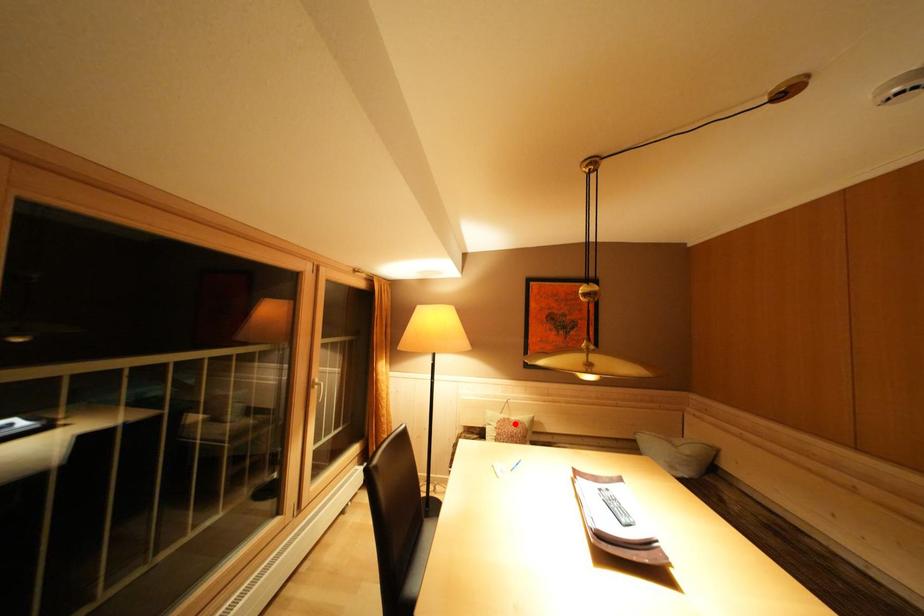
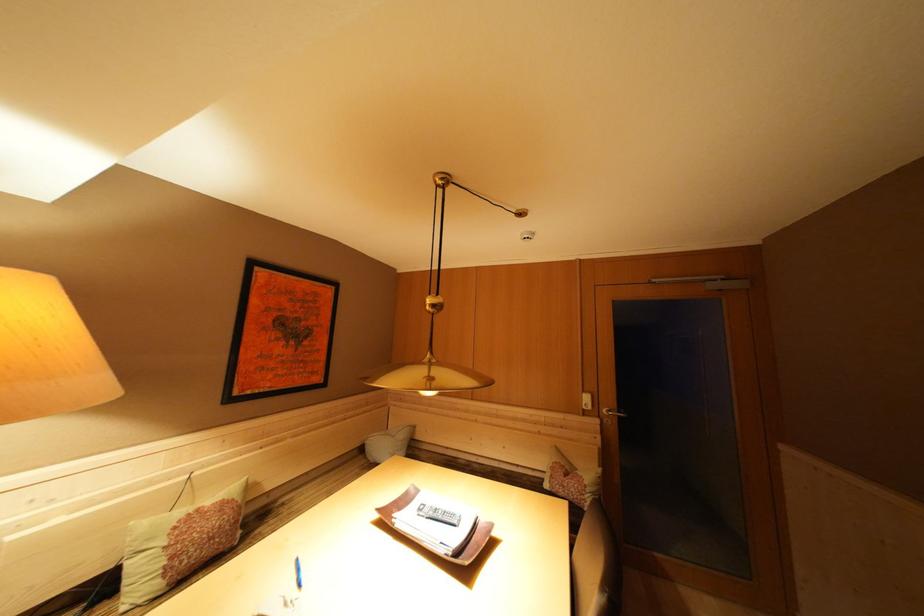
Question: I am providing you with two images of the same scene from different viewpoints. Image1 has a red point marked. In image2, the corresponding 3D location appears at what relative position? Reply with the corresponding letter.

Choices:
 (A) Closer
 (B) Farther

Answer: (A)